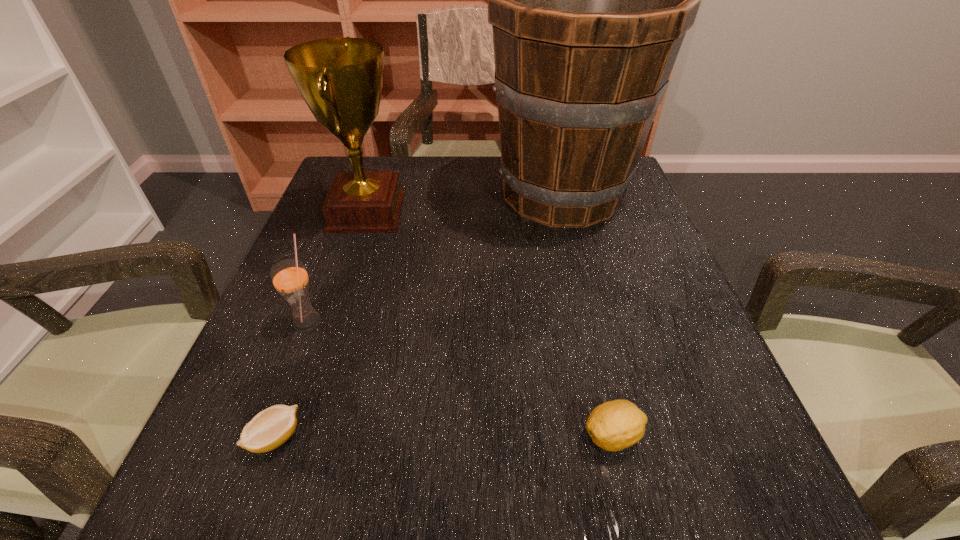
Find the location of `free space between the third tallest object and the fourth shortest object`. free space between the third tallest object and the fourth shortest object is located at coordinates (337, 266).

This screenshot has height=540, width=960. I want to click on free spot between the bucket and the left lemon, so click(x=419, y=315).

The width and height of the screenshot is (960, 540). I want to click on the second closest object to the third tallest object, so click(341, 79).

Where is `object that can be found as the third closest to the shorter lemon`? The height and width of the screenshot is (540, 960). object that can be found as the third closest to the shorter lemon is located at coordinates (615, 425).

You are a GUI agent. You are given a task and a screenshot of the screen. Output one action in this format:
    pyautogui.click(x=<x>, y=<y>)
    Task: Click on the vacant space that satisfies the following two spatial constraints: 1. at the stem end of the taller lemon; 2. on the front side of the shorter lemon
    The height and width of the screenshot is (540, 960).
    Given the screenshot: What is the action you would take?
    pyautogui.click(x=613, y=437)

The image size is (960, 540). In order to click on vacant region that satisfies the following two spatial constraints: 1. at the stem end of the taller lemon; 2. on the front side of the shorter lemon in this screenshot , I will do `click(613, 437)`.

Locate an element on the screen. Image resolution: width=960 pixels, height=540 pixels. vacant space that satisfies the following two spatial constraints: 1. on the front side of the bucket; 2. on the plaque of the award is located at coordinates [566, 213].

Locate an element on the screen. This screenshot has width=960, height=540. free space that satisfies the following two spatial constraints: 1. on the plaque of the fourth shortest object; 2. on the front side of the shorter lemon is located at coordinates (295, 437).

The image size is (960, 540). Find the location of `free point that satisfies the following two spatial constraints: 1. on the plaque of the fourth shortest object; 2. on the front side of the shortest object`. free point that satisfies the following two spatial constraints: 1. on the plaque of the fourth shortest object; 2. on the front side of the shortest object is located at coordinates pos(295,437).